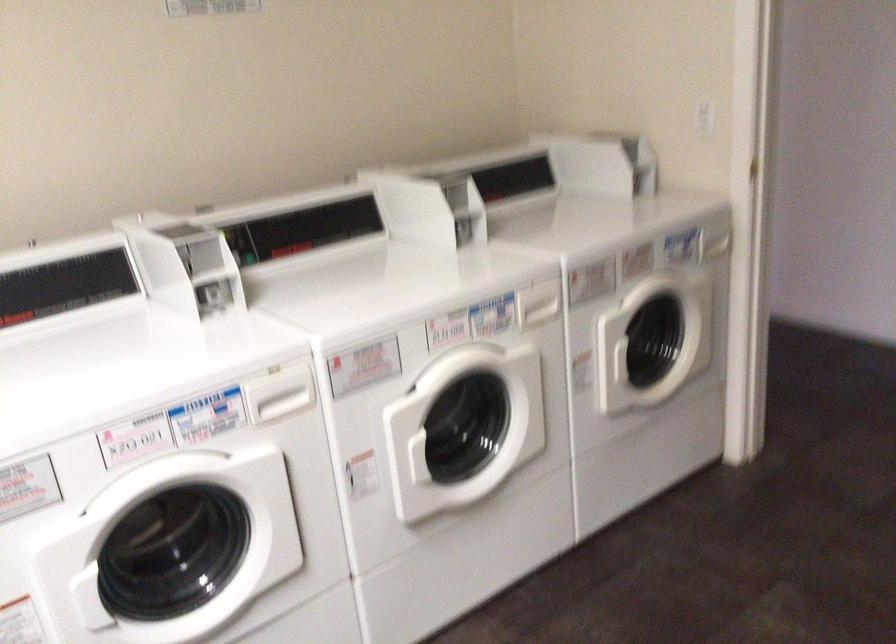
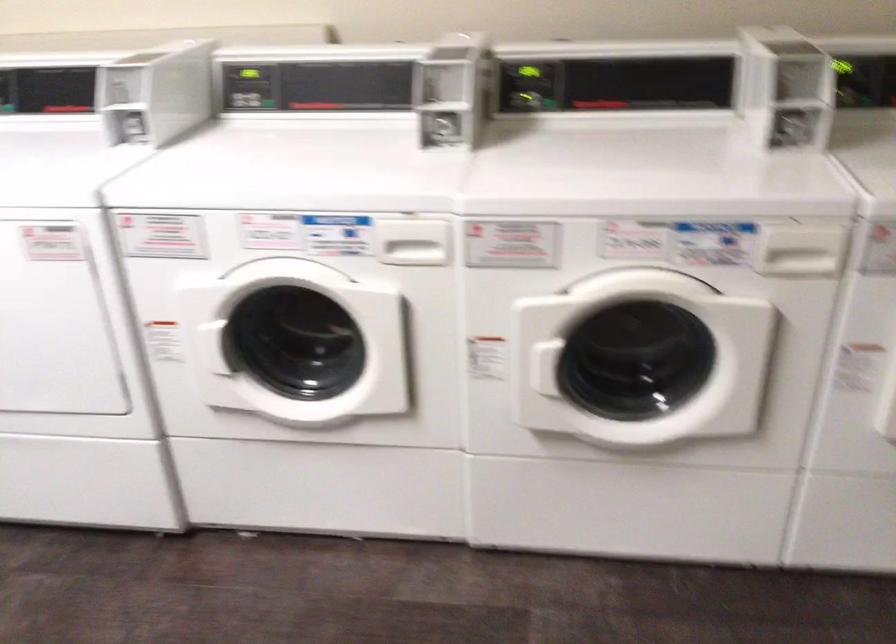
The point at (470, 228) is marked in the first image. Where is the corresponding point in the second image?

(798, 129)